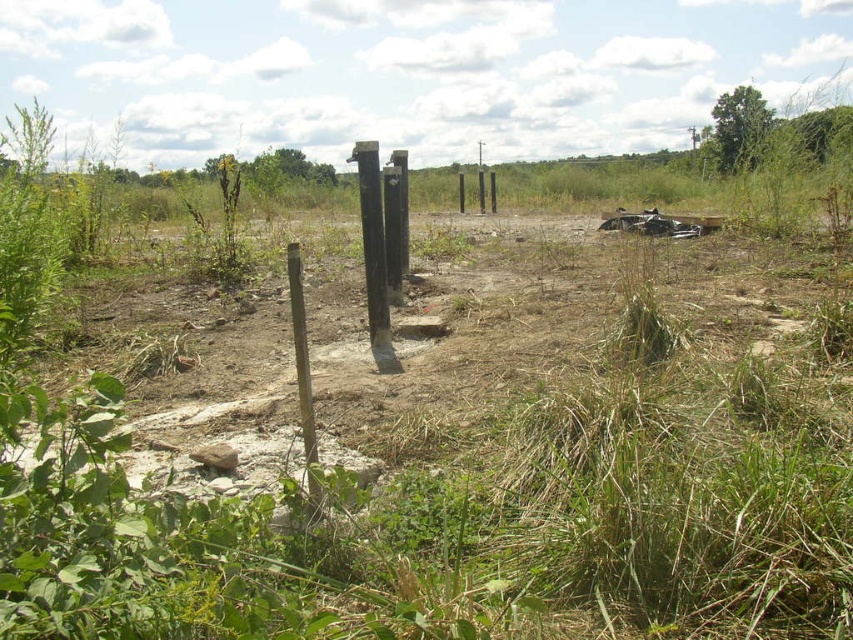
You are planning to place a small garden statue that requires a base area of 1 square meter. Given the scene, where would be the most suitable location between the brown dirt field at center and the black wood post at center?

The brown dirt field at center has a larger size compared to the black wood post at center, making it the more suitable location for placing the garden statue that requires a base area of 1 square meter.

You are standing in the open area and want to walk towards the black wood post at center. Which direction should you move relative to the brown dirt field at center?

Since the brown dirt field at center is in front of the black wood post at center, you should move towards the brown dirt field at center to reach the black wood post at center.